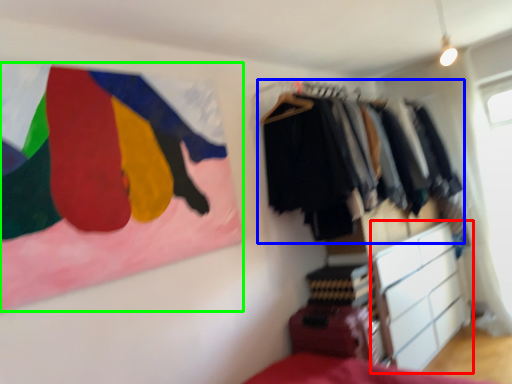
Question: Based on their relative distances, which object is nearer to chest of drawers (highlighted by a red box)? Choose from closet (highlighted by a blue box) and flag (highlighted by a green box).

Choices:
 (A) closet
 (B) flag

Answer: (A)